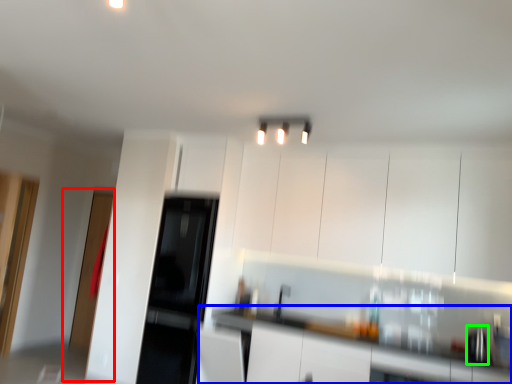
Question: Which is farther away from glass door (highlighted by a red box)? counter top (highlighted by a blue box) or appliance (highlighted by a green box)?

Choices:
 (A) counter top
 (B) appliance

Answer: (B)